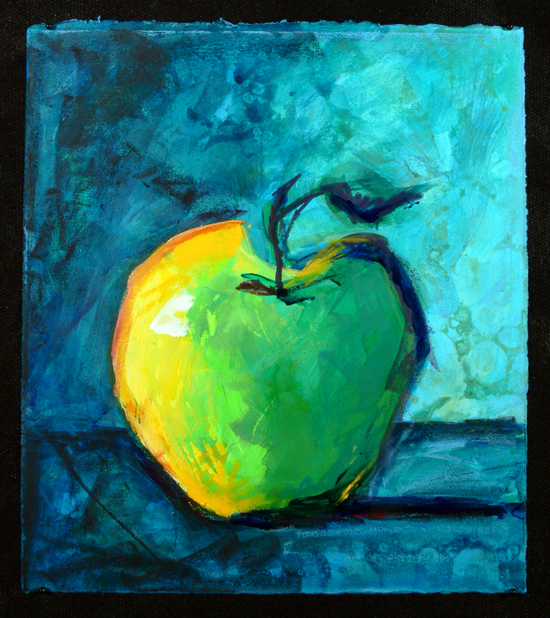
Locate an element on the screen. wall is located at coordinates (448, 218).